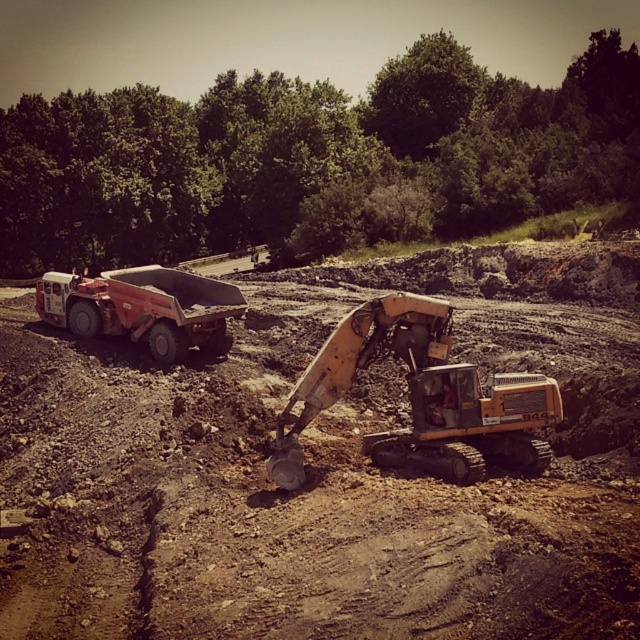
Question: Does yellow metallic excavator at center appear on the left side of matte red truck at left?

Choices:
 (A) yes
 (B) no

Answer: (B)

Question: Is yellow metallic excavator at center to the left of matte red truck at left from the viewer's perspective?

Choices:
 (A) no
 (B) yes

Answer: (A)

Question: Can you confirm if yellow metallic excavator at center is thinner than matte red truck at left?

Choices:
 (A) yes
 (B) no

Answer: (A)

Question: Which point is farther from the camera taking this photo?

Choices:
 (A) click(x=477, y=470)
 (B) click(x=156, y=333)

Answer: (B)

Question: Which of the following is the closest to the observer?

Choices:
 (A) matte red truck at left
 (B) yellow metallic excavator at center

Answer: (B)